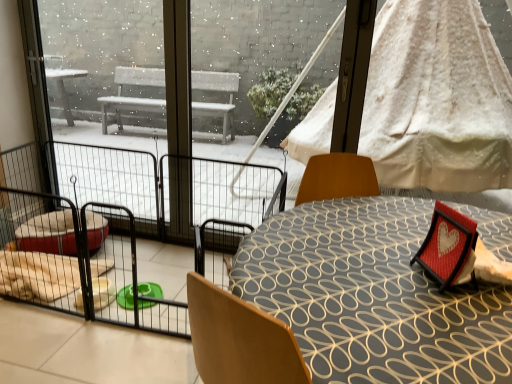
Question: Is red fabric heart frame at lower right wider than white textured fabric canopy bed at upper right?

Choices:
 (A) yes
 (B) no

Answer: (A)

Question: Is red fabric heart frame at lower right outside white textured fabric canopy bed at upper right?

Choices:
 (A) no
 (B) yes

Answer: (B)

Question: Can you confirm if red fabric heart frame at lower right is positioned to the right of white textured fabric canopy bed at upper right?

Choices:
 (A) yes
 (B) no

Answer: (B)

Question: Considering the relative sizes of red fabric heart frame at lower right and white textured fabric canopy bed at upper right in the image provided, is red fabric heart frame at lower right shorter than white textured fabric canopy bed at upper right?

Choices:
 (A) no
 (B) yes

Answer: (B)

Question: Are red fabric heart frame at lower right and white textured fabric canopy bed at upper right beside each other?

Choices:
 (A) yes
 (B) no

Answer: (B)

Question: From the image's perspective, is red fabric heart frame at lower right located above or below patterned fabric table at center?

Choices:
 (A) below
 (B) above

Answer: (B)

Question: Considering the positions of point (472, 223) and point (412, 319), is point (472, 223) closer or farther from the camera than point (412, 319)?

Choices:
 (A) closer
 (B) farther

Answer: (B)

Question: Looking at the image, does red fabric heart frame at lower right seem bigger or smaller compared to patterned fabric table at center?

Choices:
 (A) small
 (B) big

Answer: (A)

Question: Would you say red fabric heart frame at lower right is inside or outside patterned fabric table at center?

Choices:
 (A) outside
 (B) inside

Answer: (A)

Question: Considering the positions of point (328, 349) and point (453, 226), is point (328, 349) closer or farther from the camera than point (453, 226)?

Choices:
 (A) closer
 (B) farther

Answer: (A)

Question: Based on their sizes in the image, would you say patterned fabric table at center is bigger or smaller than red fabric heart frame at lower right?

Choices:
 (A) big
 (B) small

Answer: (A)

Question: Considering the relative positions of patterned fabric table at center and red fabric heart frame at lower right in the image provided, is patterned fabric table at center to the left or to the right of red fabric heart frame at lower right?

Choices:
 (A) left
 (B) right

Answer: (A)

Question: Is patterned fabric table at center spatially inside red fabric heart frame at lower right, or outside of it?

Choices:
 (A) inside
 (B) outside

Answer: (B)

Question: From the image's perspective, is white textured fabric canopy bed at upper right above or below red fabric heart frame at lower right?

Choices:
 (A) above
 (B) below

Answer: (A)

Question: Would you say white textured fabric canopy bed at upper right is to the left or to the right of red fabric heart frame at lower right in the picture?

Choices:
 (A) left
 (B) right

Answer: (B)